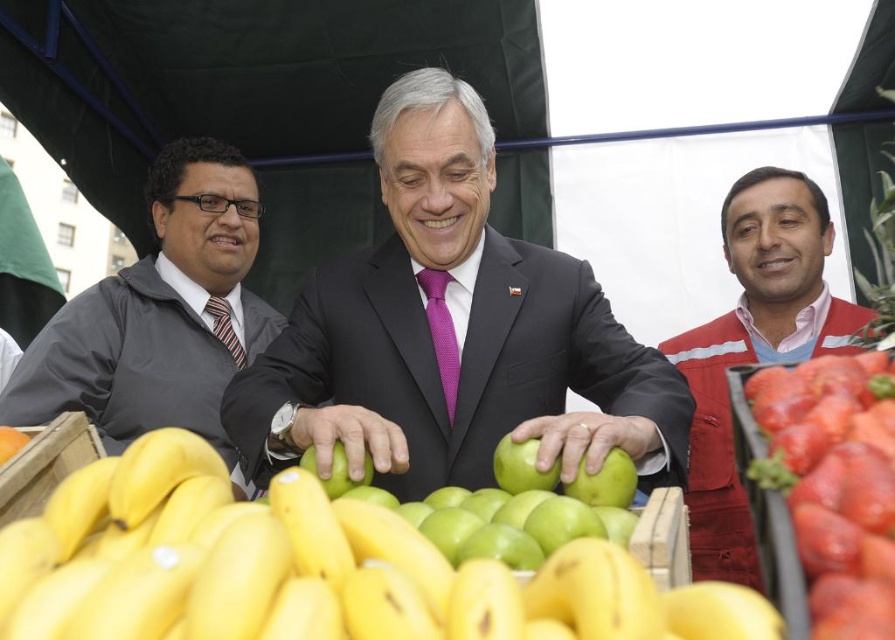
Can you confirm if matte black suit at center is bigger than red fabric vest at right?

No.

Who is more forward, (408, 417) or (722, 332)?

Positioned in front is point (408, 417).

Does point (569, 435) come closer to viewer compared to point (786, 243)?

That is True.

The image size is (895, 640). I want to click on matte black suit at center, so click(x=452, y=333).

Can you confirm if red fabric vest at right is thinner than red glossy strawberries at lower right?

In fact, red fabric vest at right might be wider than red glossy strawberries at lower right.

Is point (842, 348) positioned behind point (803, 572)?

That is True.

At what (x,y) coordinates should I click in order to perform the action: click on red fabric vest at right. Please return your answer as a coordinate pair (x, y). Looking at the image, I should click on (755, 348).

Between point (234, 538) and point (716, 563), which one is positioned behind?

Positioned behind is point (716, 563).

In order to click on yellow matte bananas at center in this screenshot , I will do `click(339, 561)`.